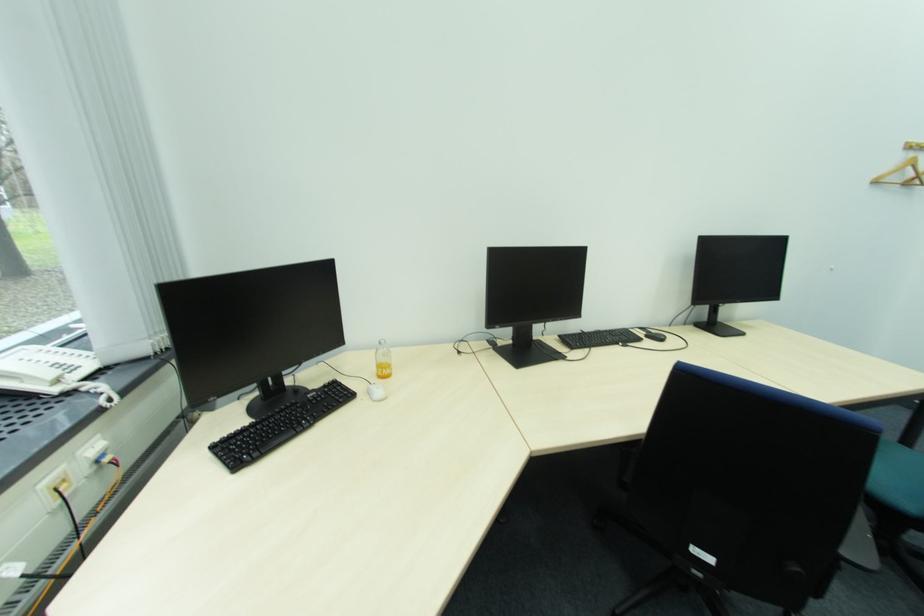
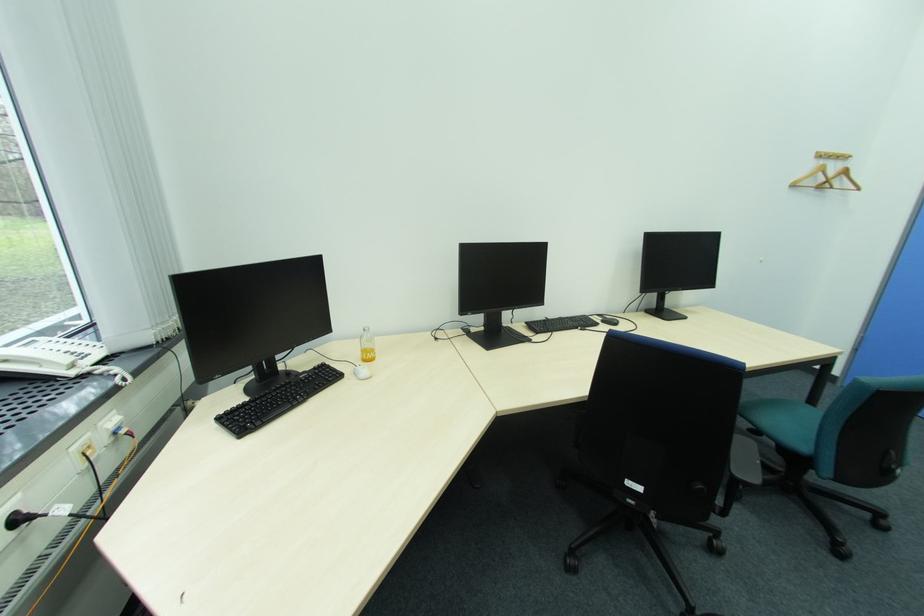
In the second image, find the point that corresponds to the point at 617,339 in the first image.

(578, 323)